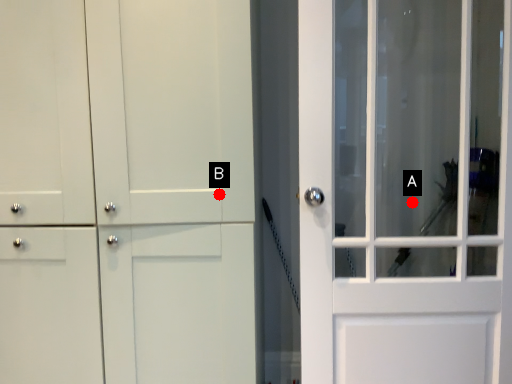
Question: Two points are circled on the image, labeled by A and B beside each circle. Which point is closer to the camera?

Choices:
 (A) A is closer
 (B) B is closer

Answer: (B)